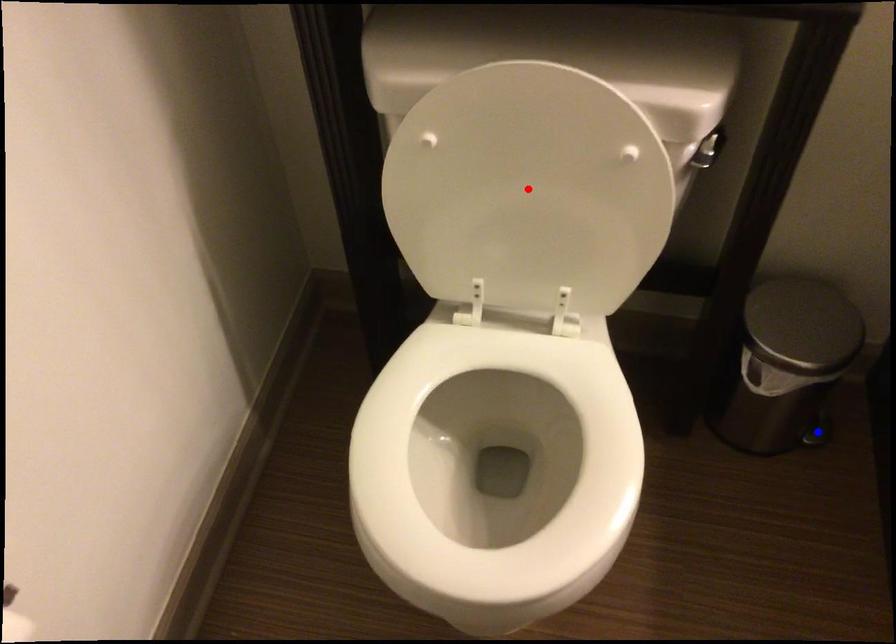
Question: Two points are marked on the image. Which point is closer to the camera?

Choices:
 (A) Blue point is closer.
 (B) Red point is closer.

Answer: (B)